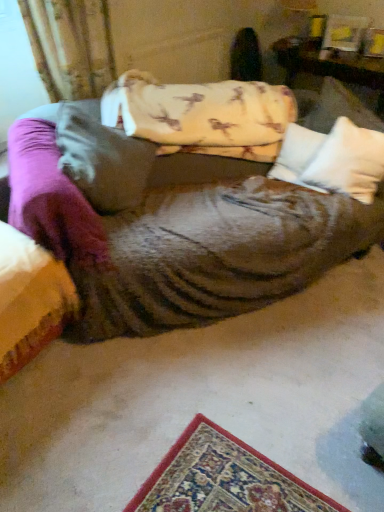
Question: Is fluffy white pillow at center, positioned as the first pillow in left-to-right order, positioned in front of white soft pillow at center, which is the 2th pillow from right to left?

Choices:
 (A) no
 (B) yes

Answer: (B)

Question: Considering the relative sizes of fluffy white pillow at center, positioned as the first pillow in left-to-right order, and white soft pillow at center, which is the 2th pillow from right to left, in the image provided, is fluffy white pillow at center, positioned as the first pillow in left-to-right order, thinner than white soft pillow at center, which is the 2th pillow from right to left,?

Choices:
 (A) yes
 (B) no

Answer: (B)

Question: Does fluffy white pillow at center, positioned as the first pillow in left-to-right order, have a lesser height compared to white soft pillow at center, placed as the 2th pillow when sorted from left to right?

Choices:
 (A) yes
 (B) no

Answer: (B)

Question: Is fluffy white pillow at center, positioned as the first pillow in left-to-right order, touching white soft pillow at center, placed as the 2th pillow when sorted from left to right?

Choices:
 (A) no
 (B) yes

Answer: (A)

Question: Considering the relative positions of fluffy white pillow at center, marked as the third pillow in a right-to-left arrangement, and white soft pillow at center, placed as the 2th pillow when sorted from left to right, in the image provided, is fluffy white pillow at center, marked as the third pillow in a right-to-left arrangement, behind white soft pillow at center, placed as the 2th pillow when sorted from left to right,?

Choices:
 (A) yes
 (B) no

Answer: (B)

Question: Is fluffy white pillow at center, marked as the third pillow in a right-to-left arrangement, positioned with its back to white soft pillow at center, placed as the 2th pillow when sorted from left to right?

Choices:
 (A) yes
 (B) no

Answer: (B)

Question: Is white soft pillow at center, the 3th pillow viewed from the left, smaller than white soft pillow at center, placed as the 2th pillow when sorted from left to right?

Choices:
 (A) no
 (B) yes

Answer: (A)

Question: Is white soft pillow at center, the 1th pillow positioned from the right, directly adjacent to white soft pillow at center, which is the 2th pillow from right to left?

Choices:
 (A) yes
 (B) no

Answer: (B)

Question: Is white soft pillow at center, placed as the 2th pillow when sorted from left to right, inside white soft pillow at center, the 1th pillow positioned from the right?

Choices:
 (A) yes
 (B) no

Answer: (B)

Question: Would you say white soft pillow at center, the 1th pillow positioned from the right, is outside white soft pillow at center, placed as the 2th pillow when sorted from left to right?

Choices:
 (A) yes
 (B) no

Answer: (A)

Question: From the image's perspective, is white soft pillow at center, the 3th pillow viewed from the left, beneath white soft pillow at center, placed as the 2th pillow when sorted from left to right?

Choices:
 (A) yes
 (B) no

Answer: (A)

Question: From a real-world perspective, is white soft pillow at center, the 3th pillow viewed from the left, on white soft pillow at center, placed as the 2th pillow when sorted from left to right?

Choices:
 (A) yes
 (B) no

Answer: (A)

Question: Can you confirm if wooden table at upper right is thinner than white soft pillow at center, placed as the 2th pillow when sorted from left to right?

Choices:
 (A) yes
 (B) no

Answer: (B)